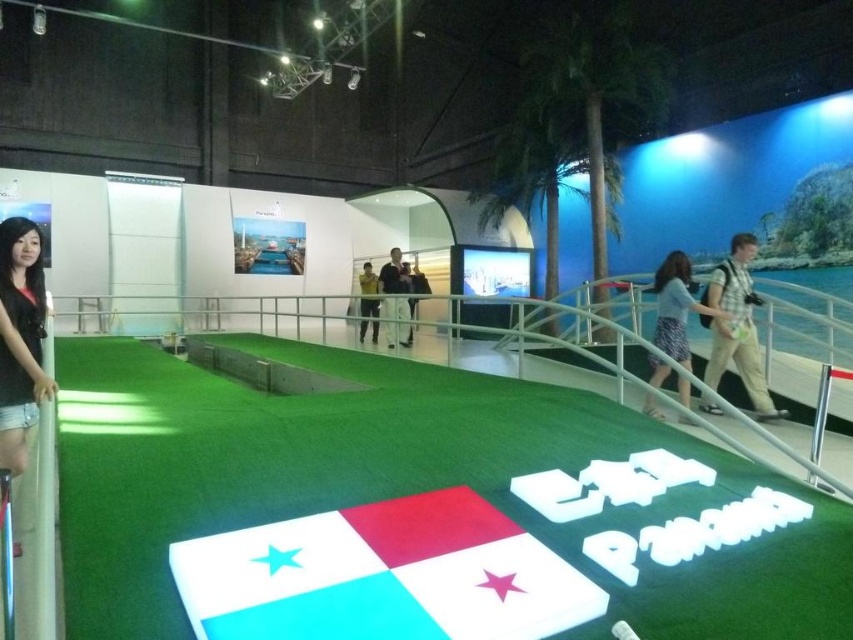
You are an event organizer planning to move the light blue fabric flag at center and the yellow fabric jacket at center to a smaller display area. Based on their sizes, which object might be easier to rearrange first?

The light blue fabric flag at center occupies less space than the yellow fabric jacket at center, so it might be easier to rearrange first due to its smaller size.

You are an event planner setting up for a Panama themed event. You have the light blue fabric flag at center and the black denim shorts at lower left. Which object should you place first if you need to prioritize larger items?

The light blue fabric flag at center should be placed first because it has a larger size compared to the black denim shorts at lower left, so larger items should be prioritized.